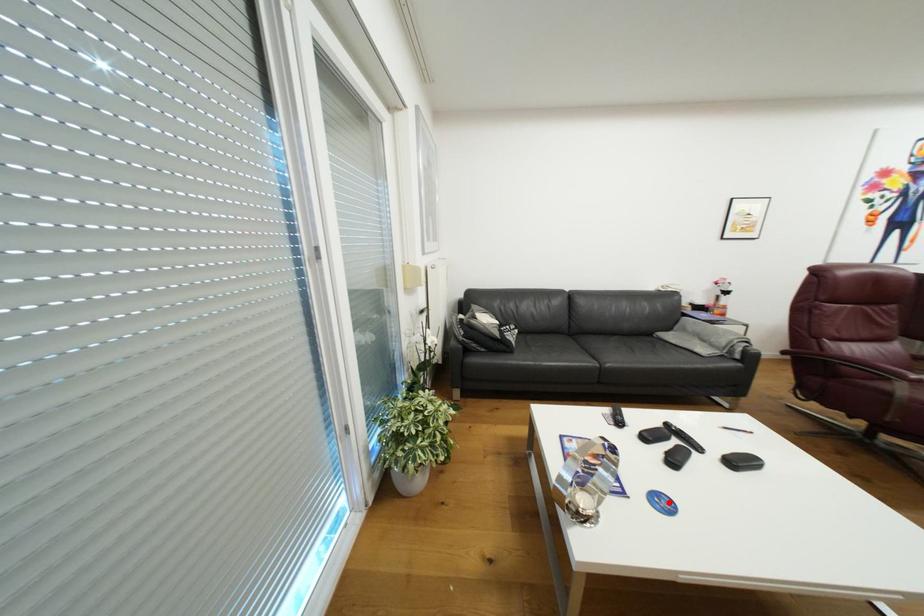
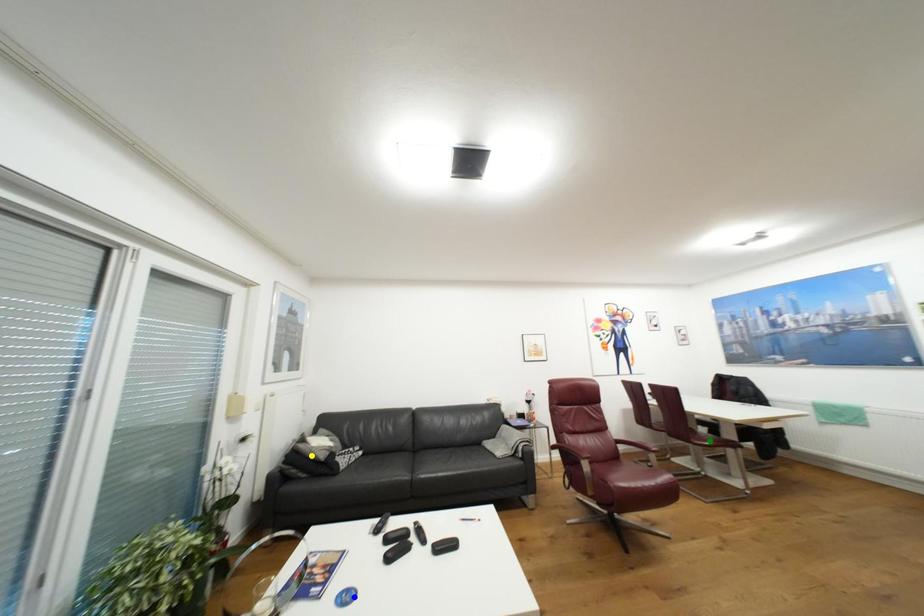
Question: I am providing you with two images of the same scene from different viewpoints. A red point is marked on the first image. You are given multiple points on the second image. Which spot in image 2 lines up with the point in image 1?

Choices:
 (A) green point
 (B) blue point
 (C) yellow point

Answer: (B)